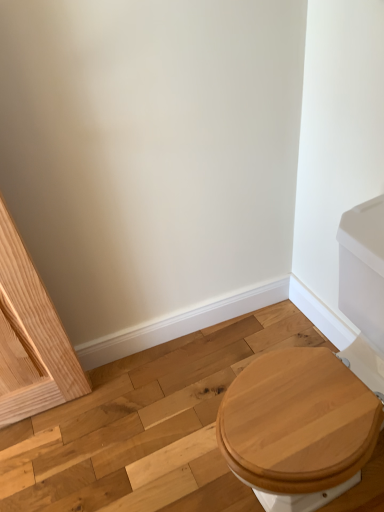
This screenshot has height=512, width=384. What do you see at coordinates (146, 429) in the screenshot?
I see `natural wood stairwell at lower right` at bounding box center [146, 429].

This screenshot has height=512, width=384. I want to click on natural wood stairwell at lower right, so click(x=146, y=429).

Find the location of a particular element. natural wood stairwell at lower right is located at coordinates (146, 429).